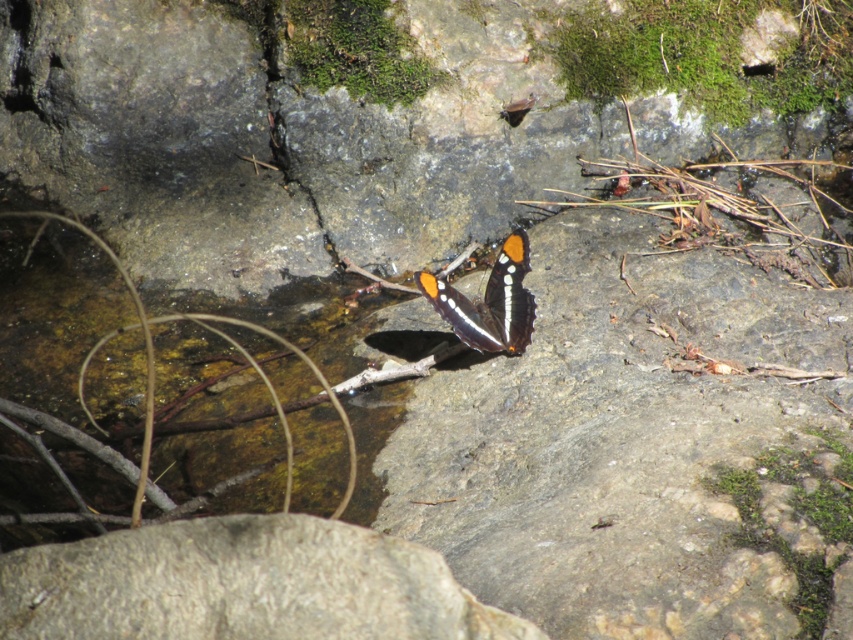
Can you confirm if gray rough boulder at center is positioned to the right of shiny orange and black wings at center?

In fact, gray rough boulder at center is to the left of shiny orange and black wings at center.

Does gray rough boulder at center have a lesser width compared to shiny orange and black wings at center?

Incorrect, gray rough boulder at center's width is not less than shiny orange and black wings at center's.

Where is `gray rough boulder at center`? This screenshot has width=853, height=640. gray rough boulder at center is located at coordinates (242, 584).